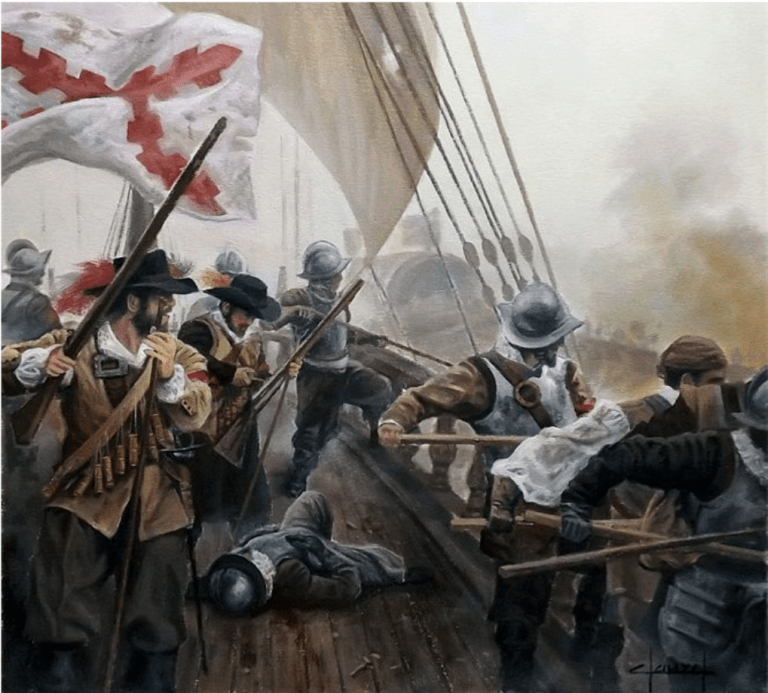
The image size is (768, 693). Identify the location of floor. (406, 565).